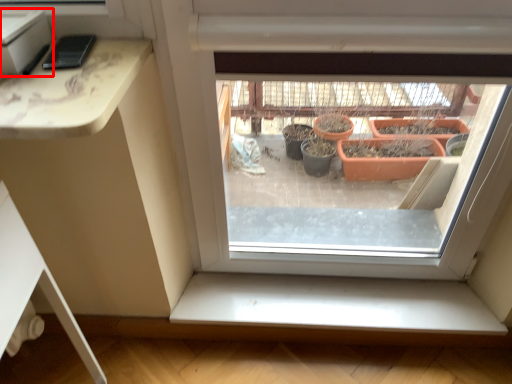
Question: Where is window box (annotated by the red box) located in relation to window sill in the image?

Choices:
 (A) right
 (B) left

Answer: (B)